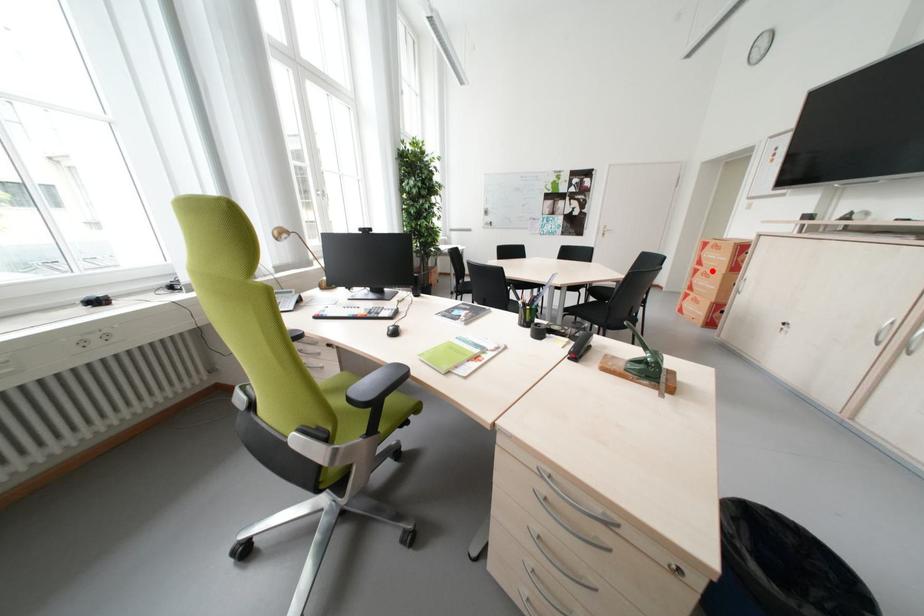
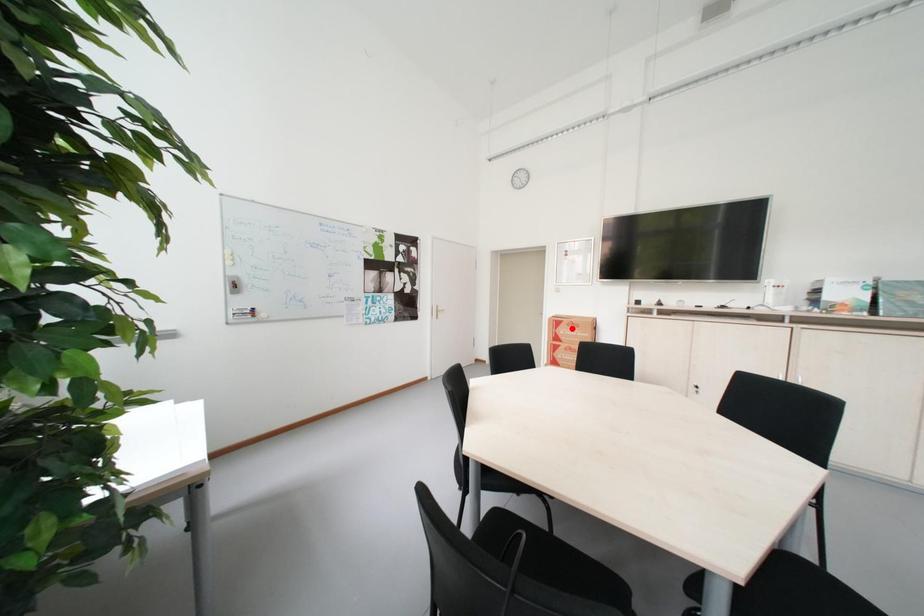
I am providing you with two images of the same scene from different viewpoints. A red point is marked on the first image and another point is marked on the second image. Is the red point in image1 aligned with the point shown in image2?

No